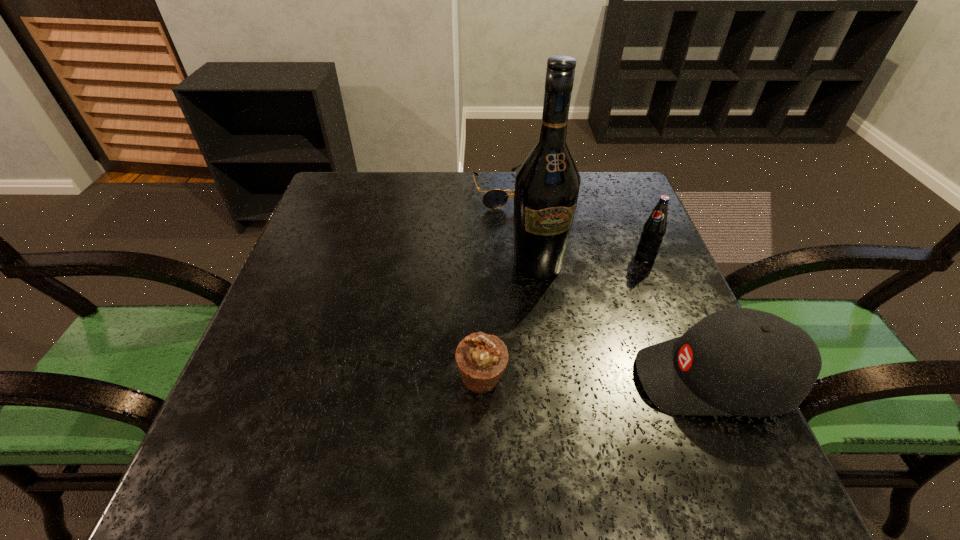
This screenshot has width=960, height=540. In order to click on vacant space located 0.190m on the lenses of the farthest object in this screenshot , I will do `click(537, 254)`.

Image resolution: width=960 pixels, height=540 pixels. What are the coordinates of `free spot located 0.110m on the lenses of the farthest object` in the screenshot? It's located at (527, 234).

You are a GUI agent. You are given a task and a screenshot of the screen. Output one action in this format:
    pyautogui.click(x=<x>, y=<y>)
    Task: Click on the free spot located 0.270m on the lenses of the farthest object
    Image resolution: width=960 pixels, height=540 pixels.
    Given the screenshot: What is the action you would take?
    pyautogui.click(x=548, y=276)

This screenshot has width=960, height=540. I want to click on vacant region located on the label of the wine bottle, so click(x=608, y=431).

You are a GUI agent. You are given a task and a screenshot of the screen. Output one action in this format:
    pyautogui.click(x=<x>, y=<y>)
    Task: Click on the blank space located on the label of the wine bottle
    Image resolution: width=960 pixels, height=540 pixels.
    Given the screenshot: What is the action you would take?
    pyautogui.click(x=585, y=376)

The width and height of the screenshot is (960, 540). Find the location of `blank area located 0.220m on the label of the wine bottle`. blank area located 0.220m on the label of the wine bottle is located at coordinates (580, 363).

Where is `free region located on the front label of the pop`? free region located on the front label of the pop is located at coordinates (608, 322).

Locate an element on the screen. vacant area situated 0.280m on the front label of the pop is located at coordinates (597, 342).

Find the location of a particular element. The image size is (960, 540). vacant space located on the front label of the pop is located at coordinates (607, 326).

At what (x,y) coordinates should I click in order to perform the action: click on object at the far edge. Please return your answer as a coordinate pair (x, y). This screenshot has height=540, width=960. Looking at the image, I should click on (495, 198).